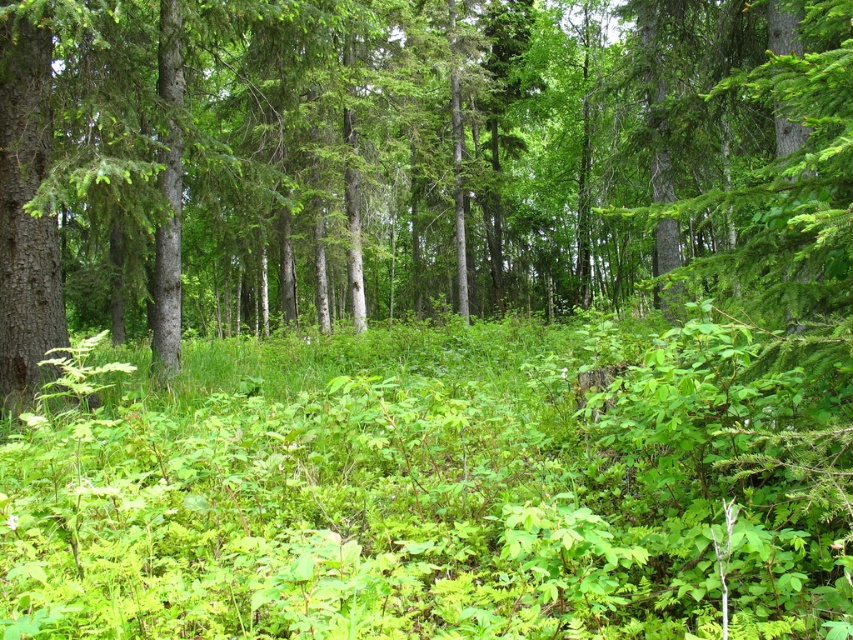
Question: Where is green matte tree at center located in relation to green leafy grass at center in the image?

Choices:
 (A) right
 (B) left

Answer: (B)

Question: Does green matte tree at center have a smaller size compared to green leafy grass at center?

Choices:
 (A) no
 (B) yes

Answer: (A)

Question: Can you confirm if green matte tree at center is bigger than green leafy grass at center?

Choices:
 (A) no
 (B) yes

Answer: (B)

Question: Among these points, which one is farthest from the camera?

Choices:
 (A) click(186, 621)
 (B) click(300, 106)

Answer: (B)